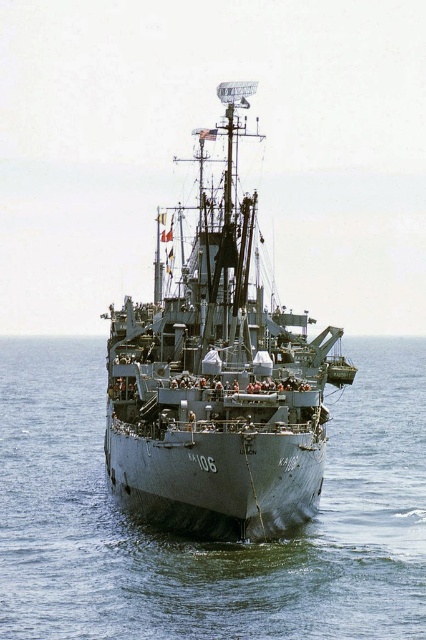
Question: Can you confirm if gray matte water at center is positioned to the left of gray metallic ship at center?

Choices:
 (A) yes
 (B) no

Answer: (A)

Question: Among these points, which one is nearest to the camera?

Choices:
 (A) (293, 500)
 (B) (129, 518)

Answer: (A)

Question: Can you confirm if gray matte water at center is bigger than gray metallic ship at center?

Choices:
 (A) yes
 (B) no

Answer: (A)

Question: Does gray matte water at center have a lesser width compared to gray metallic ship at center?

Choices:
 (A) no
 (B) yes

Answer: (A)